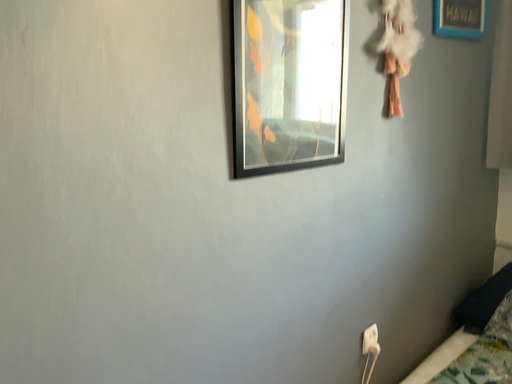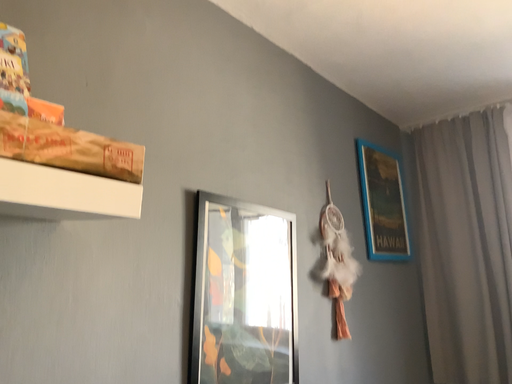
Question: How did the camera likely rotate when shooting the video?

Choices:
 (A) rotated upward
 (B) rotated downward

Answer: (A)